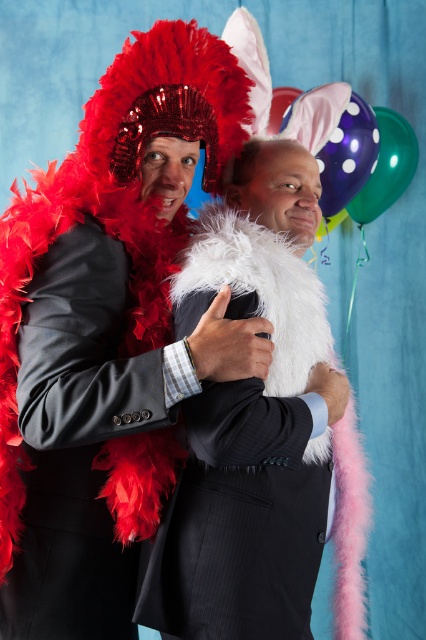
Question: Which object appears closest to the camera in this image?

Choices:
 (A) shiny purple balloon at upper right
 (B) purple dotted balloon at upper center
 (C) white fluffy boa at center

Answer: (C)

Question: Does purple dotted balloon at upper center appear under shiny purple balloon at upper right?

Choices:
 (A) no
 (B) yes

Answer: (A)

Question: Observing the image, what is the correct spatial positioning of purple dotted balloon at upper center in reference to shiny purple balloon at upper right?

Choices:
 (A) right
 (B) left

Answer: (B)

Question: Which point appears farthest from the camera in this image?

Choices:
 (A) (209, 260)
 (B) (403, 131)
 (C) (339, 186)

Answer: (B)

Question: From the image, what is the correct spatial relationship of white fluffy boa at center in relation to shiny purple balloon at upper right?

Choices:
 (A) right
 (B) left

Answer: (B)

Question: Which object is the farthest from the white fluffy boa at center?

Choices:
 (A) shiny purple balloon at upper right
 (B) purple dotted balloon at upper center

Answer: (A)